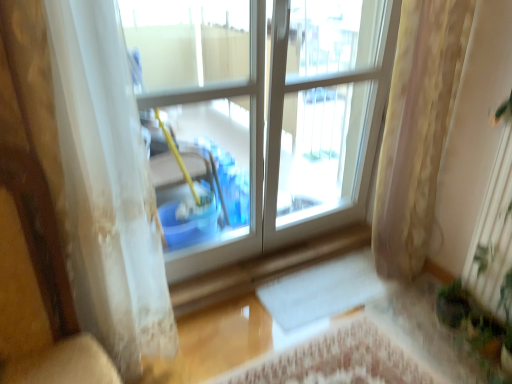
Question: Is green leafy plant at lower right wider than wooden armchair at left?

Choices:
 (A) no
 (B) yes

Answer: (A)

Question: Is green leafy plant at lower right outside wooden armchair at left?

Choices:
 (A) yes
 (B) no

Answer: (A)

Question: Can you confirm if green leafy plant at lower right is shorter than wooden armchair at left?

Choices:
 (A) no
 (B) yes

Answer: (B)

Question: Is green leafy plant at lower right oriented towards wooden armchair at left?

Choices:
 (A) yes
 (B) no

Answer: (A)

Question: Does green leafy plant at lower right have a lesser width compared to wooden armchair at left?

Choices:
 (A) no
 (B) yes

Answer: (B)

Question: Would you say white sheer curtain at left, which is counted as the 1th curtain, starting from the left, is to the left or to the right of yellow floral fabric curtain at right, arranged as the 1th curtain when viewed from the right, in the picture?

Choices:
 (A) left
 (B) right

Answer: (A)

Question: Considering the positions of white sheer curtain at left, which is the second curtain in right-to-left order, and yellow floral fabric curtain at right, arranged as the 1th curtain when viewed from the right, in the image, is white sheer curtain at left, which is the second curtain in right-to-left order, taller or shorter than yellow floral fabric curtain at right, arranged as the 1th curtain when viewed from the right,?

Choices:
 (A) short
 (B) tall

Answer: (B)

Question: Considering their positions, is white sheer curtain at left, which is the second curtain in right-to-left order, located in front of or behind yellow floral fabric curtain at right, which is the 2th curtain from left to right?

Choices:
 (A) behind
 (B) front

Answer: (B)

Question: From the image's perspective, is white sheer curtain at left, which is counted as the 1th curtain, starting from the left, positioned above or below yellow floral fabric curtain at right, which is the 2th curtain from left to right?

Choices:
 (A) below
 (B) above

Answer: (A)

Question: Choose the correct answer: Is white sheer curtain at left, which is counted as the 1th curtain, starting from the left, inside green leafy plant at lower right or outside it?

Choices:
 (A) inside
 (B) outside

Answer: (B)

Question: Based on their sizes in the image, would you say white sheer curtain at left, which is counted as the 1th curtain, starting from the left, is bigger or smaller than green leafy plant at lower right?

Choices:
 (A) big
 (B) small

Answer: (A)

Question: From the image's perspective, relative to green leafy plant at lower right, is white sheer curtain at left, which is the second curtain in right-to-left order, above or below?

Choices:
 (A) above
 (B) below

Answer: (A)

Question: Relative to green leafy plant at lower right, is white sheer curtain at left, which is counted as the 1th curtain, starting from the left, in front or behind?

Choices:
 (A) behind
 (B) front

Answer: (B)

Question: From the image's perspective, is wooden armchair at left located above or below green leafy plant at lower right?

Choices:
 (A) below
 (B) above

Answer: (B)

Question: Based on their sizes in the image, would you say wooden armchair at left is bigger or smaller than green leafy plant at lower right?

Choices:
 (A) small
 (B) big

Answer: (B)